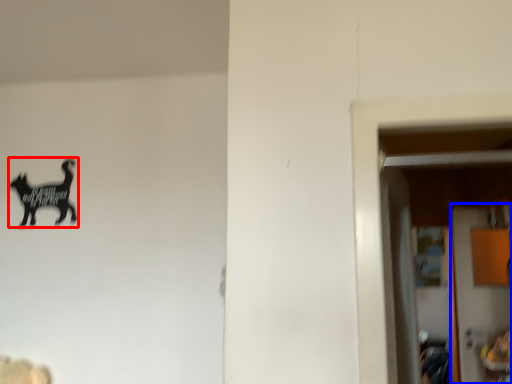
Question: Which of the following is the closest to the observer, animal (highlighted by a red box) or door (highlighted by a blue box)?

Choices:
 (A) animal
 (B) door

Answer: (A)